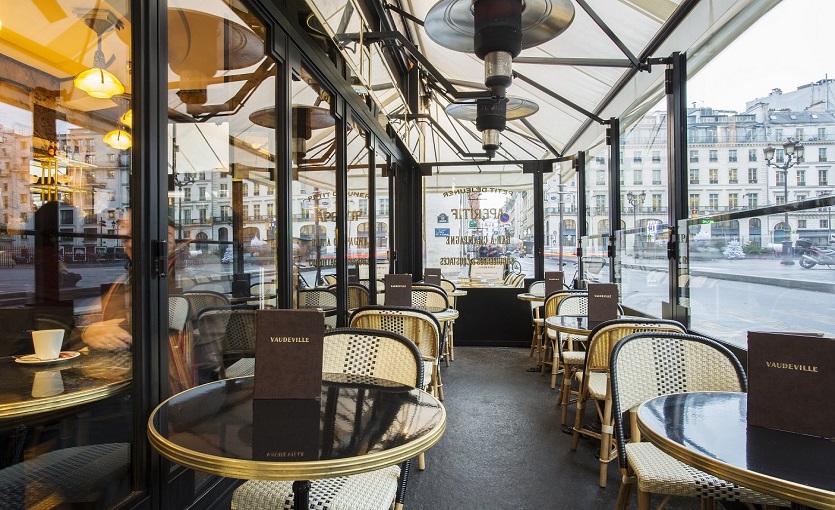
At what (x,y) coordinates should I click in order to perform the action: click on seat of chair. Please return your answer as a coordinate pair (x, y). This screenshot has width=835, height=510. Looking at the image, I should click on (362, 494), (664, 476), (600, 382), (573, 352), (560, 335), (535, 319), (428, 376), (240, 359).